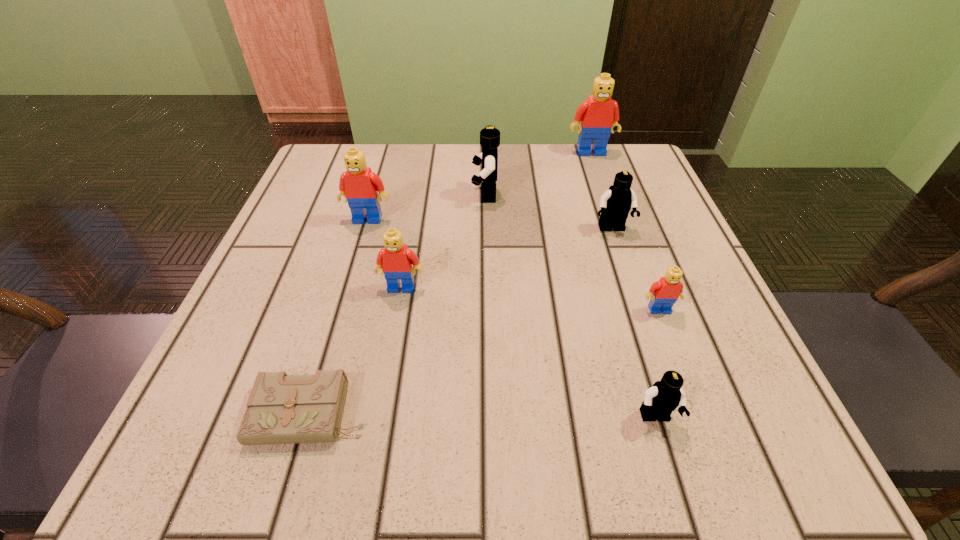
The image size is (960, 540). Identify the location of free space located 0.090m on the face of the third red Lego from right to left. (393, 338).

The image size is (960, 540). Find the location of `vacant space located 0.320m on the front-facing side of the second nearest black Lego`. vacant space located 0.320m on the front-facing side of the second nearest black Lego is located at coordinates (664, 387).

Where is `vacant space located on the face of the nearest red Lego`? vacant space located on the face of the nearest red Lego is located at coordinates tap(705, 430).

I want to click on vacant point located 0.280m on the right of the shortest object, so click(583, 414).

The height and width of the screenshot is (540, 960). I want to click on Lego present at the near edge, so click(x=664, y=396).

The width and height of the screenshot is (960, 540). In order to click on diary present at the near edge in this screenshot , I will do `click(281, 409)`.

Locate an element on the screen. Image resolution: width=960 pixels, height=540 pixels. Lego that is positioned at the left edge is located at coordinates (359, 185).

I want to click on diary present at the left edge, so click(281, 409).

Locate an element on the screen. object at the near left corner is located at coordinates coord(281,409).

This screenshot has width=960, height=540. I want to click on object located in the far right corner section of the desktop, so click(598, 114).